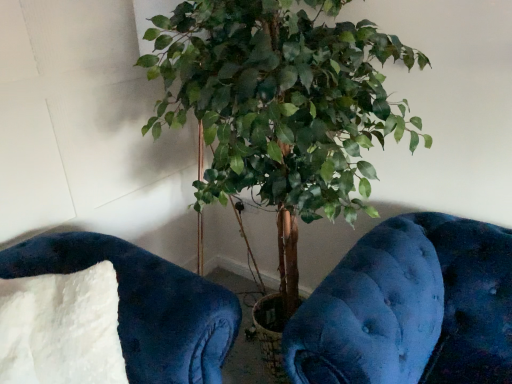
Question: Should I look upward or downward to see green leafy plant at center?

Choices:
 (A) down
 (B) up

Answer: (A)

Question: Is velvety blue cushion at lower left not close to green leafy plant at center?

Choices:
 (A) no
 (B) yes

Answer: (A)

Question: Would you say green leafy plant at center is part of velvety blue cushion at lower left's contents?

Choices:
 (A) no
 (B) yes

Answer: (A)

Question: Is velvety blue cushion at lower left touching green leafy plant at center?

Choices:
 (A) no
 (B) yes

Answer: (A)

Question: From the image's perspective, is velvety blue cushion at lower left above green leafy plant at center?

Choices:
 (A) no
 (B) yes

Answer: (A)

Question: Can you confirm if velvety blue cushion at lower left is wider than green leafy plant at center?

Choices:
 (A) no
 (B) yes

Answer: (A)

Question: From a real-world perspective, does velvety blue cushion at lower left sit lower than green leafy plant at center?

Choices:
 (A) no
 (B) yes

Answer: (B)

Question: Can you confirm if white fluffy pillow at lower left is taller than velvety blue cushion at lower left?

Choices:
 (A) no
 (B) yes

Answer: (B)

Question: Considering the relative sizes of white fluffy pillow at lower left and velvety blue cushion at lower left in the image provided, is white fluffy pillow at lower left thinner than velvety blue cushion at lower left?

Choices:
 (A) yes
 (B) no

Answer: (B)

Question: Considering the relative sizes of white fluffy pillow at lower left and velvety blue cushion at lower left in the image provided, is white fluffy pillow at lower left wider than velvety blue cushion at lower left?

Choices:
 (A) no
 (B) yes

Answer: (B)

Question: From the image's perspective, is white fluffy pillow at lower left on velvety blue cushion at lower left?

Choices:
 (A) yes
 (B) no

Answer: (B)

Question: From a real-world perspective, is white fluffy pillow at lower left under velvety blue cushion at lower left?

Choices:
 (A) no
 (B) yes

Answer: (A)

Question: Does white fluffy pillow at lower left have a larger size compared to velvety blue cushion at lower left?

Choices:
 (A) no
 (B) yes

Answer: (A)

Question: Considering the relative sizes of velvety blue cushion at lower left and white fluffy pillow at lower left in the image provided, is velvety blue cushion at lower left shorter than white fluffy pillow at lower left?

Choices:
 (A) no
 (B) yes

Answer: (B)